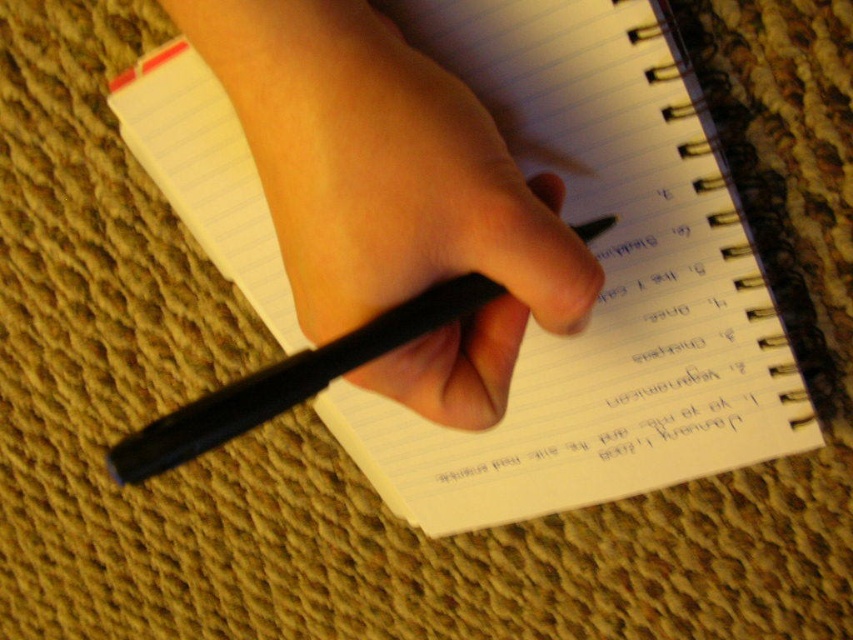
You are a photographer trying to capture a closeup of the notebook in the scene. The camera you are using has a depth of field that can focus clearly on objects within 17 inches from the camera. Based on the information provided, will the point at coordinates point (x=556, y=3) be in focus in your photo?

The point at coordinates point (x=556, y=3) is 16.96 inches from the camera, which is within the 17 inches depth of field range. Therefore, the point will be in focus in the photo.

Looking at this image, you are a graphic designer working on a layout. You need to place a logo exactly at the center of the white paper notebook at center. According to the coordinates provided, where should you position the logo?

The white paper notebook at center is located at point (604, 284), so you should position the logo at the center coordinates of (604, 284) to ensure it is centered on the notebook.

You are trying to write something in the notebook. The tip of the pen is at point (349, 276). If your hand is 14.29 inches away from the notebook, will you be able to reach the pen tip to the notebook?

The point (349, 276) is 14.29 inches away from the viewer, so yes, you can reach the pen tip to the notebook since the distance matches the hand position.